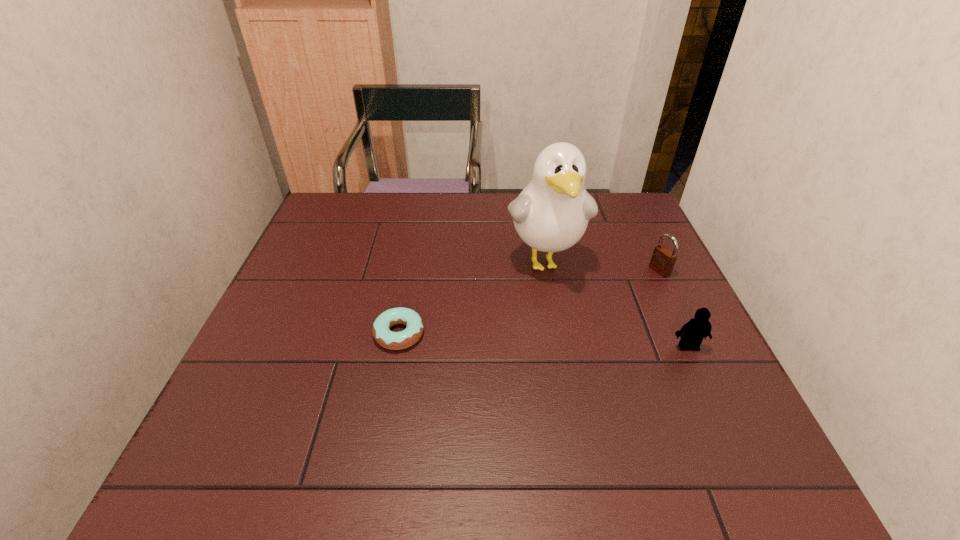
Image resolution: width=960 pixels, height=540 pixels. What are the coordinates of `vacant space located 0.210m on the beak of the gull` in the screenshot? It's located at (574, 361).

Where is `vacant point located on the front-facing side of the padlock`? vacant point located on the front-facing side of the padlock is located at coordinates (563, 316).

You are a GUI agent. You are given a task and a screenshot of the screen. Output one action in this format:
    pyautogui.click(x=<x>, y=<y>)
    Task: Click on the vacant space located on the front-facing side of the padlock
    
    Given the screenshot: What is the action you would take?
    pyautogui.click(x=575, y=310)

Find the location of a particular element. Image resolution: width=960 pixels, height=540 pixels. free space located on the front-facing side of the padlock is located at coordinates (539, 327).

The height and width of the screenshot is (540, 960). What are the coordinates of `object situated at the far edge` in the screenshot? It's located at (551, 214).

Where is `Lego present at the right edge`? This screenshot has height=540, width=960. Lego present at the right edge is located at coordinates 698,327.

I want to click on padlock present at the right edge, so click(x=663, y=260).

Where is `vacant area at the far edge of the desktop`? The height and width of the screenshot is (540, 960). vacant area at the far edge of the desktop is located at coordinates click(x=483, y=215).

Where is `free space at the near edge`? This screenshot has width=960, height=540. free space at the near edge is located at coordinates (474, 396).

I want to click on vacant space at the left edge, so click(309, 245).